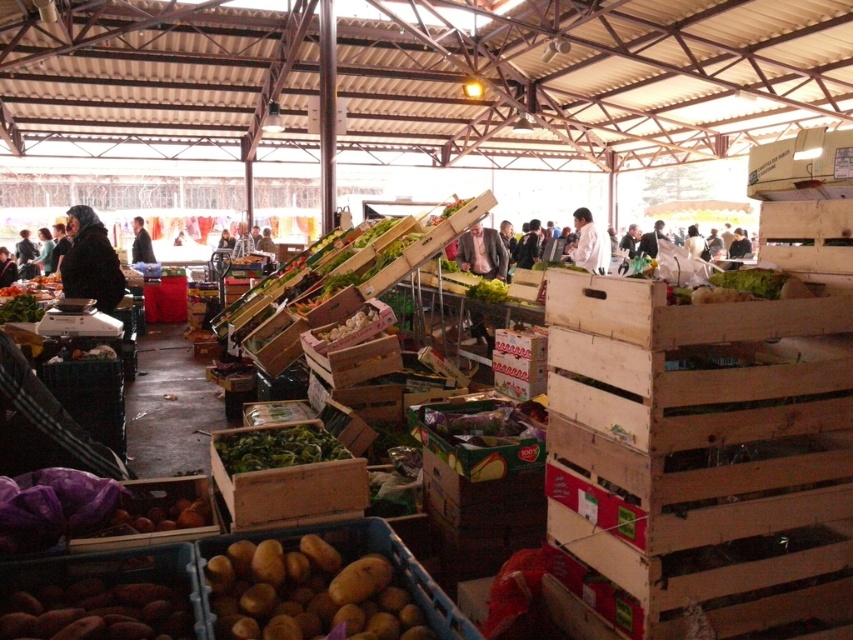
You are a vendor at the market who needs to place a new crate between the dark gray jacket at center and the black fabric jacket at left. Which jacket should you move to make space, considering their sizes?

The dark gray jacket at center has a larger width than the black fabric jacket at left, so you should move the black fabric jacket at left to make more space for the new crate.